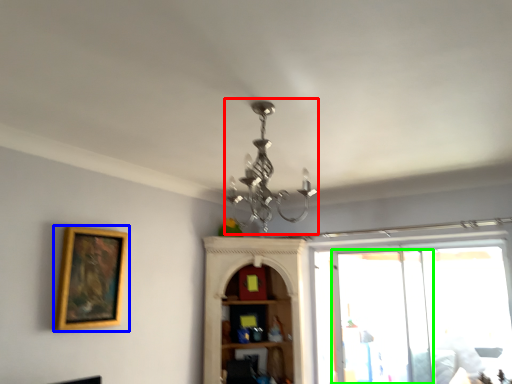
Question: Which is nearer to the light fixture (highlighted by a red box)? picture frame (highlighted by a blue box) or screen door (highlighted by a green box).

Choices:
 (A) picture frame
 (B) screen door

Answer: (A)